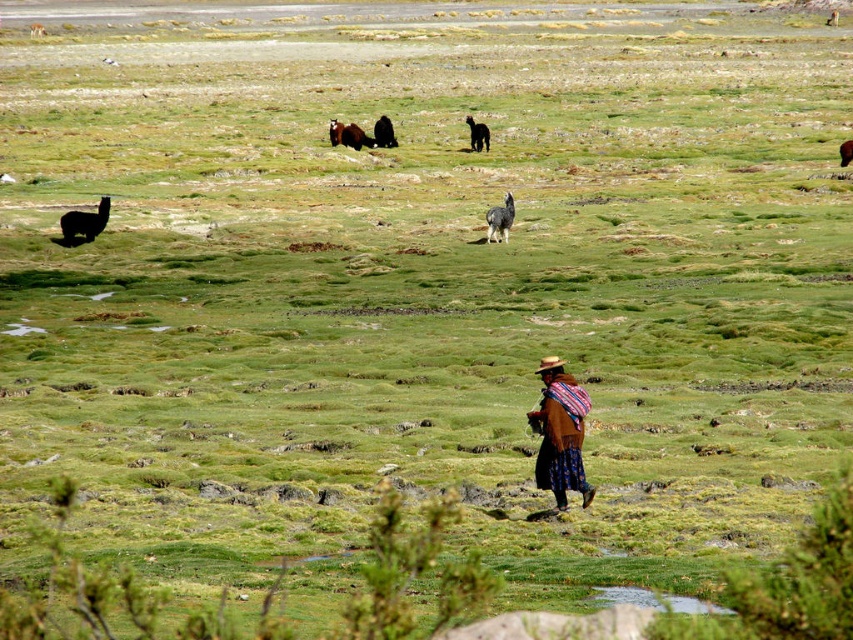
Question: Which object is closer to the camera taking this photo?

Choices:
 (A) brown woven hat at center
 (B) white woolen llama at center
 (C) brown woolen alpaca at upper center
 (D) dark brown woolen llama at center

Answer: (A)

Question: Observing the image, what is the correct spatial positioning of white woolen llama at center in reference to brown woolen llama at center?

Choices:
 (A) above
 (B) below

Answer: (B)

Question: Is brown woolen alpaca at upper center bigger than dark brown woolen llama at upper center?

Choices:
 (A) yes
 (B) no

Answer: (A)

Question: Which point is farther to the camera?

Choices:
 (A) (585, 499)
 (B) (509, 218)
 (C) (381, 147)

Answer: (C)

Question: Which of the following is the closest to the observer?

Choices:
 (A) (570, 472)
 (B) (341, 128)

Answer: (A)

Question: Can you confirm if black woolen llama at left is smaller than white woolen llama at center?

Choices:
 (A) no
 (B) yes

Answer: (A)